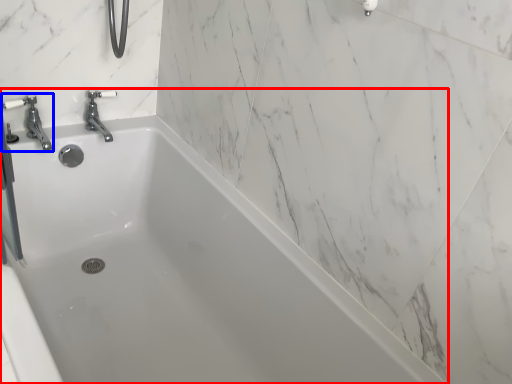
Question: Which object appears farthest to the camera in this image, bathtub (highlighted by a red box) or tap (highlighted by a blue box)?

Choices:
 (A) bathtub
 (B) tap

Answer: (B)